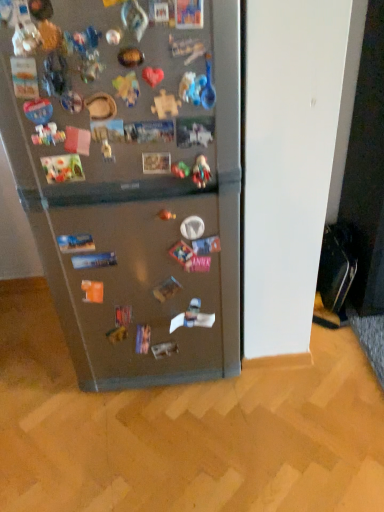
Question: Looking at their shapes, would you say plastic toy at center is wider or thinner than satin metallic refrigerator at center?

Choices:
 (A) wide
 (B) thin

Answer: (B)

Question: From the image's perspective, is plastic toy at center positioned above or below satin metallic refrigerator at center?

Choices:
 (A) below
 (B) above

Answer: (B)

Question: Based on their positions, is plastic toy at center located to the left or right of satin metallic refrigerator at center?

Choices:
 (A) right
 (B) left

Answer: (A)

Question: Is satin metallic refrigerator at center inside or outside of plastic toy at center?

Choices:
 (A) outside
 (B) inside

Answer: (A)

Question: From the image's perspective, is satin metallic refrigerator at center located above or below plastic toy at center?

Choices:
 (A) below
 (B) above

Answer: (A)

Question: From their relative heights in the image, would you say satin metallic refrigerator at center is taller or shorter than plastic toy at center?

Choices:
 (A) tall
 (B) short

Answer: (A)

Question: Considering their positions, is satin metallic refrigerator at center located in front of or behind plastic toy at center?

Choices:
 (A) front
 (B) behind

Answer: (A)